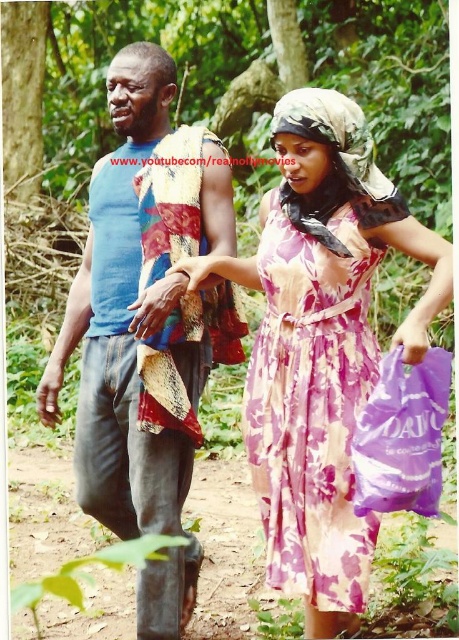
You are a hiker who wants to pick up the purple plastic bag at lower right and the purple fabric bag at lower right from the ground. Which one would you need to bend down more to reach?

The purple plastic bag at lower right is located below purple fabric bag at lower right, so you would need to bend down more to reach the purple plastic bag at lower right.

You are taking a photo of two people in the forest. You notice two points in the image at coordinates point (132, 48) and point (399, 397). Which point is closer to your camera?

Point (132, 48) is closer to the camera than point (399, 397).

Please provide the 2D coordinates of the floral chiffon dress at center in the image.

The 2D coordinates of the floral chiffon dress at center are at point (312, 406).